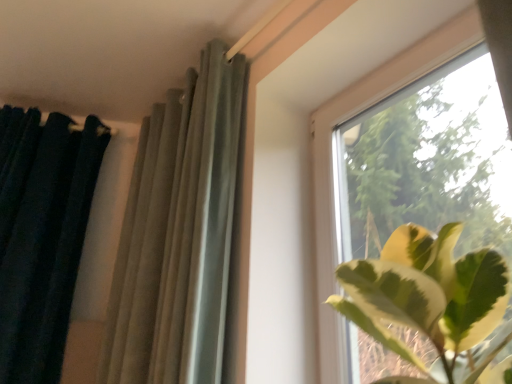
Question: Does satin gray curtain at upper center, the 2th curtain when ordered from left to right, come in front of dark green velvet curtain at left, positioned as the 2th curtain in right-to-left order?

Choices:
 (A) no
 (B) yes

Answer: (B)

Question: Is satin gray curtain at upper center, the 2th curtain when ordered from left to right, positioned with its back to dark green velvet curtain at left, positioned as the 2th curtain in right-to-left order?

Choices:
 (A) no
 (B) yes

Answer: (A)

Question: Is satin gray curtain at upper center, which ranks as the first curtain in right-to-left order, at the left side of dark green velvet curtain at left, which is counted as the first curtain, starting from the left?

Choices:
 (A) yes
 (B) no

Answer: (B)

Question: Can dark green velvet curtain at left, which is counted as the first curtain, starting from the left, be found inside satin gray curtain at upper center, the 2th curtain when ordered from left to right?

Choices:
 (A) no
 (B) yes

Answer: (A)

Question: Is satin gray curtain at upper center, which ranks as the first curtain in right-to-left order, taller than dark green velvet curtain at left, which is counted as the first curtain, starting from the left?

Choices:
 (A) yes
 (B) no

Answer: (B)

Question: Based on their positions, is dark green velvet curtain at left, positioned as the 2th curtain in right-to-left order, located to the left or right of satin gray curtain at upper center, which ranks as the first curtain in right-to-left order?

Choices:
 (A) left
 (B) right

Answer: (A)

Question: Is dark green velvet curtain at left, positioned as the 2th curtain in right-to-left order, bigger or smaller than satin gray curtain at upper center, which ranks as the first curtain in right-to-left order?

Choices:
 (A) small
 (B) big

Answer: (B)

Question: In the image, is dark green velvet curtain at left, positioned as the 2th curtain in right-to-left order, positioned in front of or behind satin gray curtain at upper center, which ranks as the first curtain in right-to-left order?

Choices:
 (A) behind
 (B) front

Answer: (A)

Question: Considering the positions of point (53, 228) and point (174, 362), is point (53, 228) closer or farther from the camera than point (174, 362)?

Choices:
 (A) farther
 (B) closer

Answer: (A)

Question: Based on their sizes in the image, would you say satin gray curtain at upper center, which ranks as the first curtain in right-to-left order, is bigger or smaller than dark green velvet curtain at left, positioned as the 2th curtain in right-to-left order?

Choices:
 (A) big
 (B) small

Answer: (B)

Question: Considering the positions of point (167, 284) and point (84, 178), is point (167, 284) closer or farther from the camera than point (84, 178)?

Choices:
 (A) farther
 (B) closer

Answer: (B)

Question: From a real-world perspective, is satin gray curtain at upper center, the 2th curtain when ordered from left to right, above or below dark green velvet curtain at left, positioned as the 2th curtain in right-to-left order?

Choices:
 (A) below
 (B) above

Answer: (B)

Question: In terms of height, does satin gray curtain at upper center, which ranks as the first curtain in right-to-left order, look taller or shorter compared to dark green velvet curtain at left, positioned as the 2th curtain in right-to-left order?

Choices:
 (A) tall
 (B) short

Answer: (B)

Question: In the image, is dark green velvet curtain at left, positioned as the 2th curtain in right-to-left order, on the left side or the right side of transparent glass window at upper right?

Choices:
 (A) right
 (B) left

Answer: (B)

Question: Do you think dark green velvet curtain at left, which is counted as the first curtain, starting from the left, is within transparent glass window at upper right, or outside of it?

Choices:
 (A) inside
 (B) outside

Answer: (B)